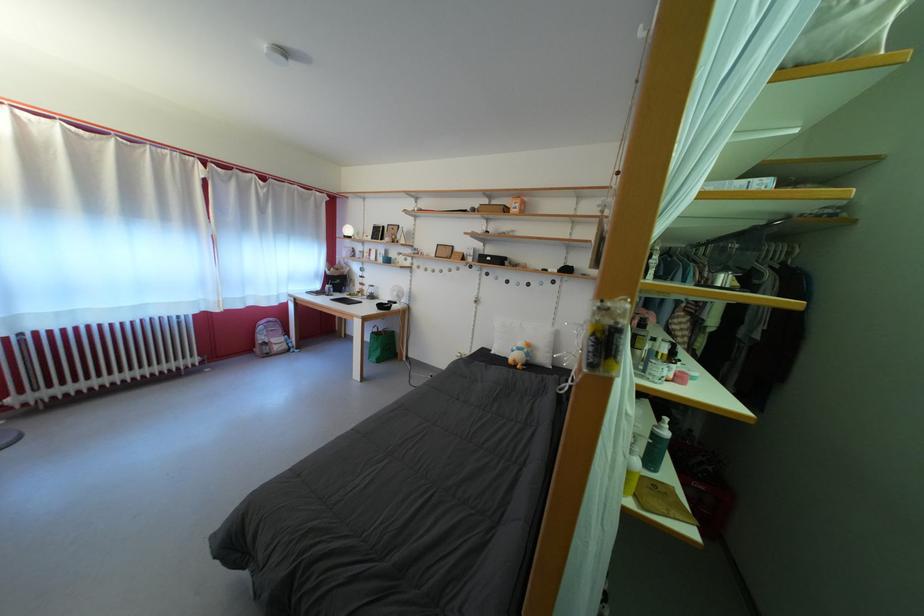
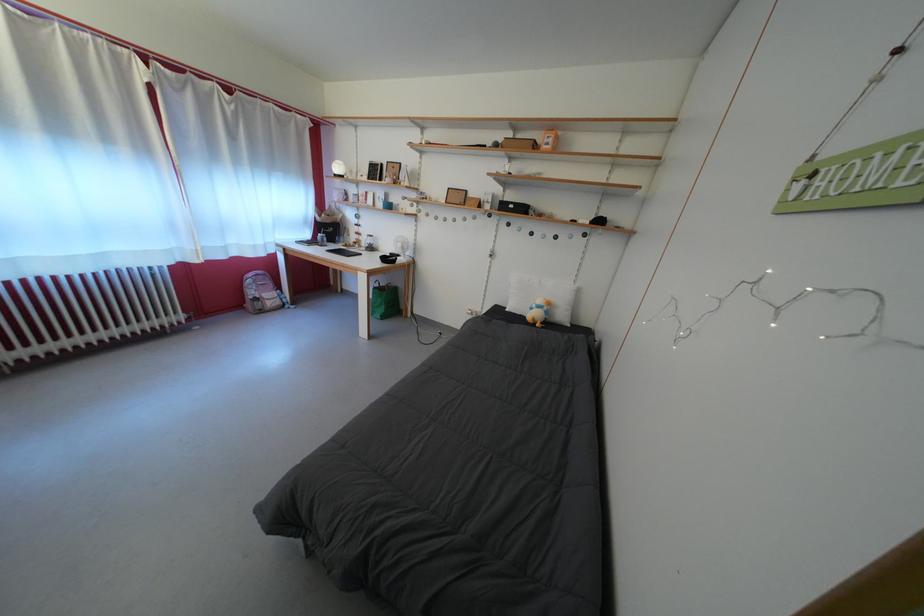
Question: The first image is from the beginning of the video and the second image is from the end. How did the camera likely rotate when shooting the video?

Choices:
 (A) Left
 (B) Right
 (C) Up
 (D) Down

Answer: (D)